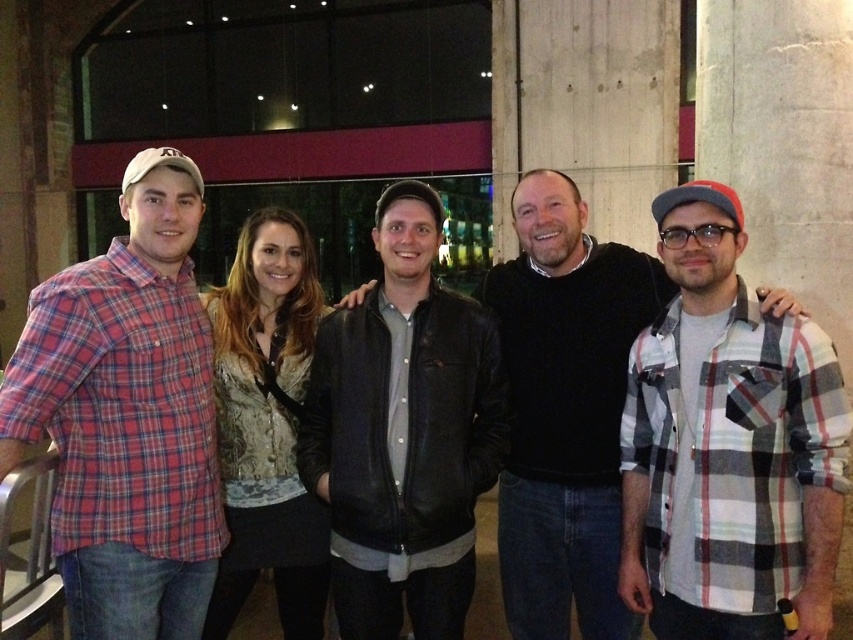
Is point (694, 604) farther from camera compared to point (399, 461)?

That is False.

Is plaid flannel shirt at center above black leather jacket at center?

Yes, plaid flannel shirt at center is above black leather jacket at center.

Which is behind, point (663, 636) or point (316, 429)?

Positioned behind is point (316, 429).

Locate an element on the screen. This screenshot has height=640, width=853. plaid flannel shirt at center is located at coordinates (728, 445).

Looking at this image, does plaid flannel shirt at center have a greater width compared to plaid cotton shirt at left?

Correct, the width of plaid flannel shirt at center exceeds that of plaid cotton shirt at left.

Between plaid flannel shirt at center and plaid cotton shirt at left, which one has less height?

With less height is plaid flannel shirt at center.

You are a GUI agent. You are given a task and a screenshot of the screen. Output one action in this format:
    pyautogui.click(x=<x>, y=<y>)
    Task: Click on the plaid flannel shirt at center
    Image resolution: width=853 pixels, height=640 pixels.
    Given the screenshot: What is the action you would take?
    pos(728,445)

Between point (190, 264) and point (608, 608), which one is positioned in front?

Positioned in front is point (190, 264).

Is plaid cotton shirt at left smaller than leather jacket at center?

Correct, plaid cotton shirt at left occupies less space than leather jacket at center.

Image resolution: width=853 pixels, height=640 pixels. What do you see at coordinates (126, 417) in the screenshot? I see `plaid cotton shirt at left` at bounding box center [126, 417].

Where is `plaid cotton shirt at left`? This screenshot has width=853, height=640. plaid cotton shirt at left is located at coordinates (126, 417).